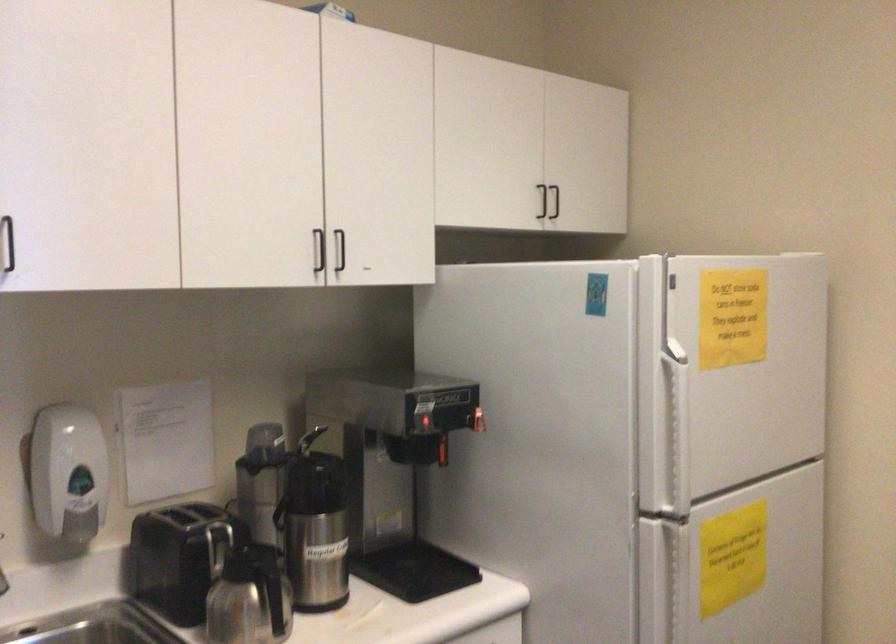
Identify the location of coffee carafe handle. This screenshot has width=896, height=644. (251, 599).